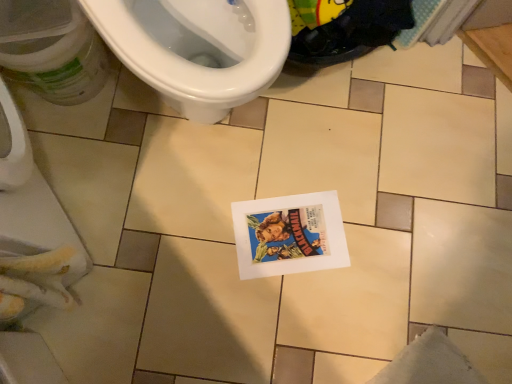
At what (x,y) coordinates should I click in order to perform the action: click on free space underneath white paper comic book at center (from a real-world perspective). Please return your answer as a coordinate pair (x, y). The height and width of the screenshot is (384, 512). Looking at the image, I should click on (291, 237).